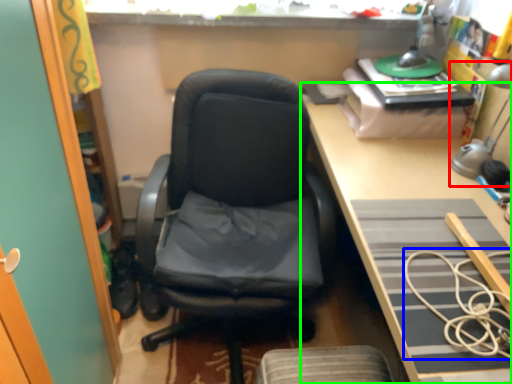
Question: Estimate the real-world distances between objects in this image. Which object is closer to table lamp (highlighted by a red box), rope (highlighted by a blue box) or desk (highlighted by a green box)?

Choices:
 (A) rope
 (B) desk

Answer: (B)